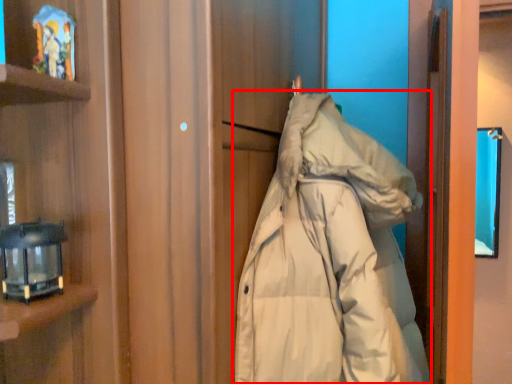
Question: Considering the relative positions of jacket (annotated by the red box) and lamp in the image provided, where is jacket (annotated by the red box) located with respect to the staircase?

Choices:
 (A) right
 (B) left

Answer: (A)